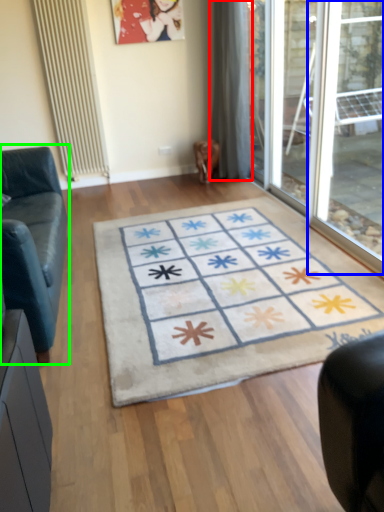
Question: Which is farther away from curtain (highlighted by a red box)? window (highlighted by a blue box) or studio couch (highlighted by a green box)?

Choices:
 (A) window
 (B) studio couch

Answer: (B)